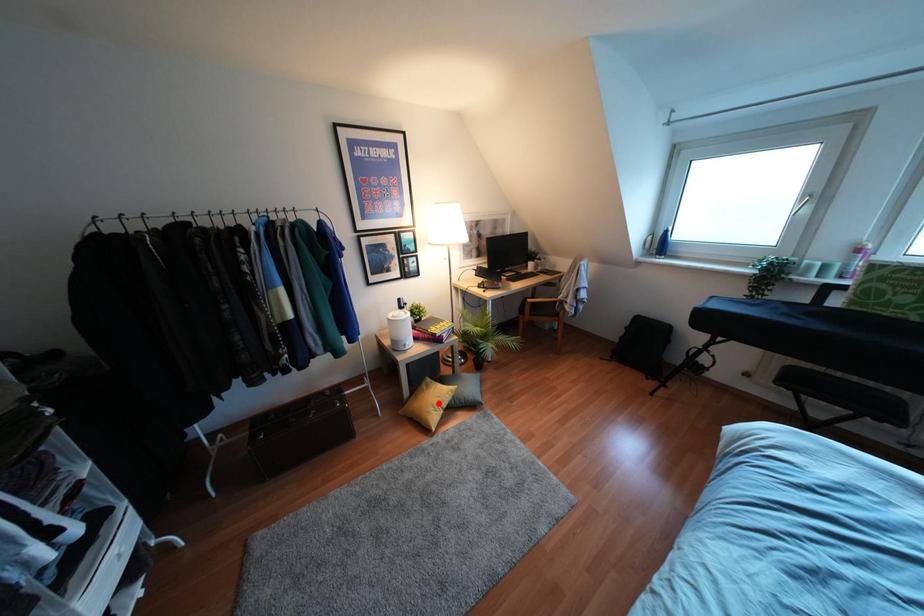
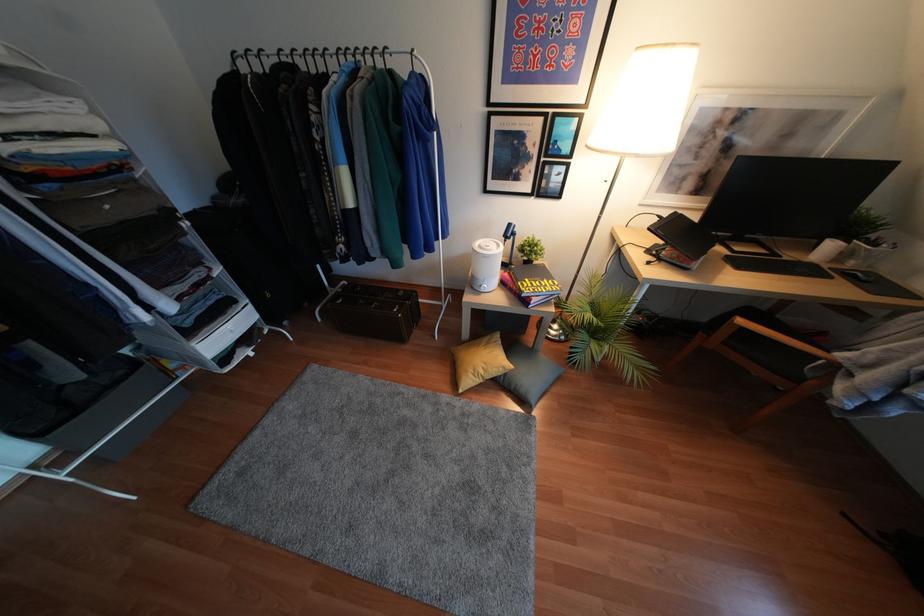
Question: I am providing you with two images of the same scene from different viewpoints. Image1 has a red point marked. In image2, the corresponding 3D location appears at what relative position? Reply with the corresponding letter.

Choices:
 (A) Closer
 (B) Farther

Answer: (B)